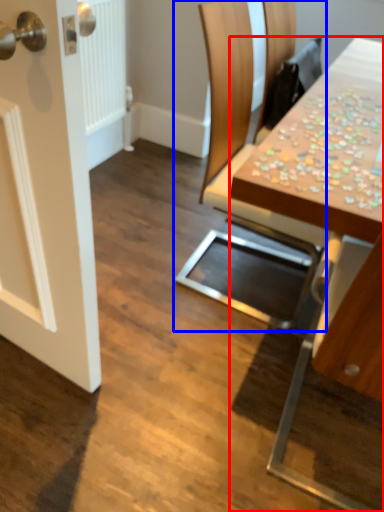
Question: Which point is further to the camera, table (highlighted by a red box) or chair (highlighted by a blue box)?

Choices:
 (A) table
 (B) chair

Answer: (B)